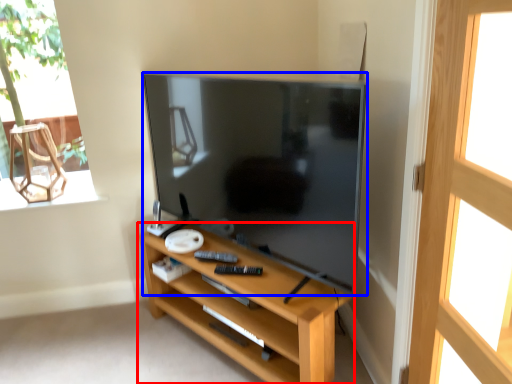
Question: Among these objects, which one is nearest to the camera, shelf (highlighted by a red box) or television (highlighted by a blue box)?

Choices:
 (A) shelf
 (B) television

Answer: (B)